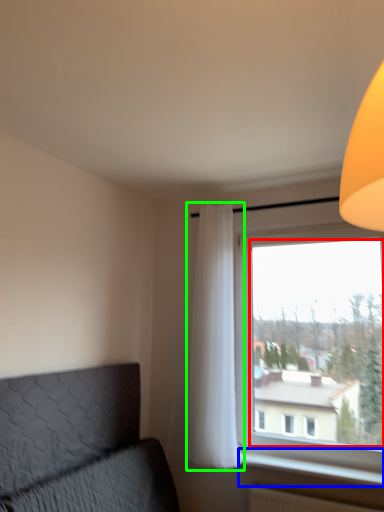
Question: Based on their relative distances, which object is farther from window screen (highlighted by a red box)? Choose from window sill (highlighted by a blue box) and curtain (highlighted by a green box).

Choices:
 (A) window sill
 (B) curtain

Answer: (A)